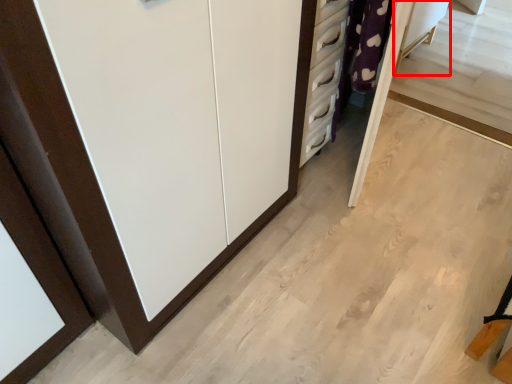
Question: From the image's perspective, what is the correct spatial positioning of vanity (annotated by the red box) in reference to cupboard?

Choices:
 (A) above
 (B) below

Answer: (A)